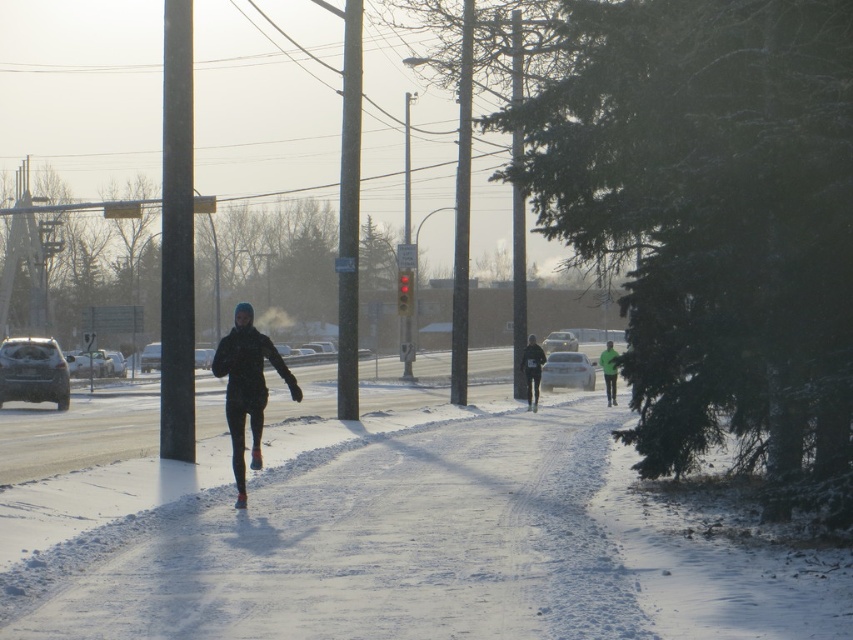
Question: Which object is the closest to the green matte jacket at center?

Choices:
 (A) black matte jacket at center
 (B) black fabric jacket at center

Answer: (B)

Question: Does black matte jacket at center have a smaller size compared to black fabric jacket at center?

Choices:
 (A) yes
 (B) no

Answer: (B)

Question: Is black fabric jacket at center bigger than green matte jacket at center?

Choices:
 (A) no
 (B) yes

Answer: (A)

Question: In this image, where is black matte jacket at center located relative to black fabric jacket at center?

Choices:
 (A) above
 (B) below

Answer: (B)

Question: Which point appears farthest from the camera in this image?

Choices:
 (A) (235, 465)
 (B) (529, 401)
 (C) (608, 340)

Answer: (C)

Question: Which object is farther from the camera taking this photo?

Choices:
 (A) black fabric jacket at center
 (B) green matte jacket at center

Answer: (A)